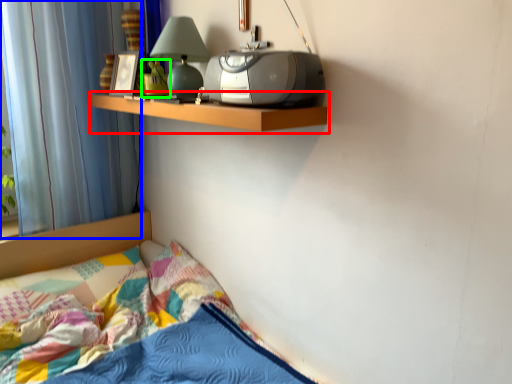
Question: Which is nearer to the shelf (highlighted by a red box)? curtain (highlighted by a blue box) or toy (highlighted by a green box).

Choices:
 (A) curtain
 (B) toy

Answer: (B)